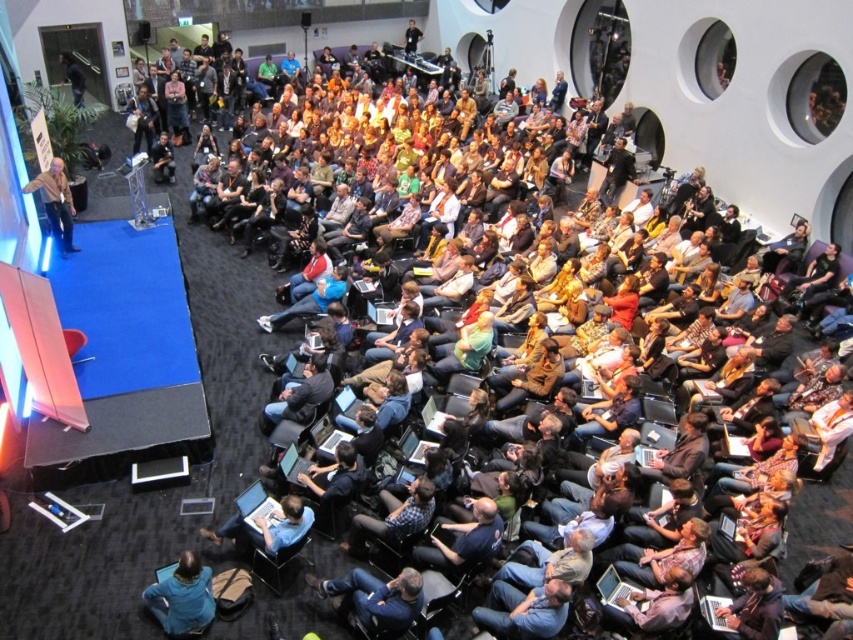
How much distance is there between blue denim jeans at lower center and plaid shirt at center?

blue denim jeans at lower center and plaid shirt at center are 24.43 inches apart from each other.

Which is more to the right, blue denim jeans at lower center or plaid shirt at center?

From the viewer's perspective, plaid shirt at center appears more on the right side.

Who is more distant from viewer, (337, 593) or (387, 525)?

Positioned behind is point (387, 525).

Where is `blue denim jeans at lower center`? The height and width of the screenshot is (640, 853). blue denim jeans at lower center is located at coordinates (375, 598).

Between blue denim jeans at lower center and light brown leather jacket at left, which one appears on the left side from the viewer's perspective?

light brown leather jacket at left

Who is more distant from viewer, (x=375, y=618) or (x=74, y=211)?

The point (x=74, y=211) is more distant.

Is point (402, 604) farther from viewer compared to point (50, 180)?

No, (402, 604) is closer to viewer.

Find the location of a particular element. blue denim jeans at lower center is located at coordinates (375, 598).

Does blue denim jeans at lower center have a larger size compared to dark brown leather jacket at lower right?

Yes.

Is blue denim jeans at lower center taller than dark brown leather jacket at lower right?

Correct, blue denim jeans at lower center is much taller as dark brown leather jacket at lower right.

Which is behind, point (341, 586) or point (753, 595)?

The point (341, 586) is behind.

At what (x,y) coordinates should I click in order to perform the action: click on blue denim jeans at lower center. Please return your answer as a coordinate pair (x, y). This screenshot has height=640, width=853. Looking at the image, I should click on (375, 598).